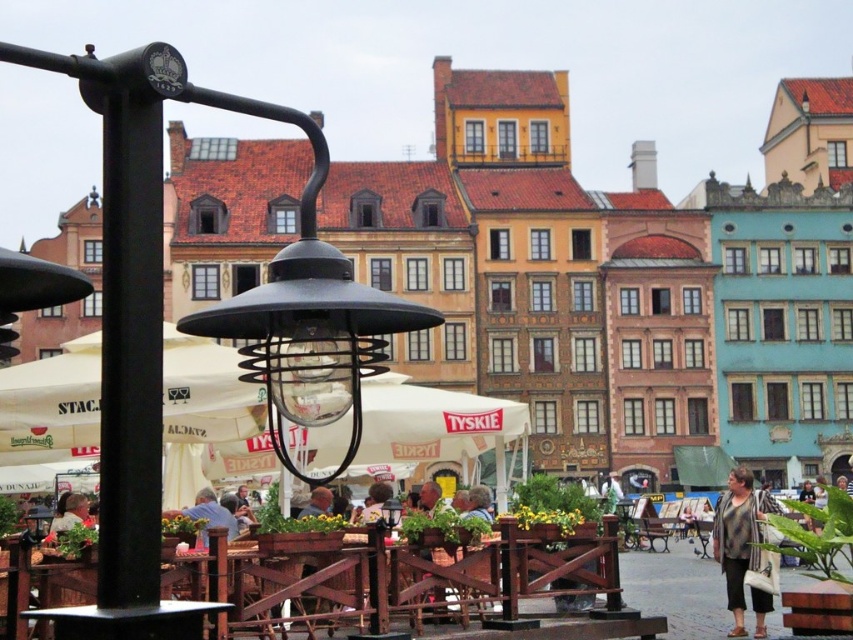
You are setting up a picnic blanket in the town square and need to place it between the wooden table at lower left and the striped fabric shirt at lower right. Which object should you move to make space, and why?

You should move the striped fabric shirt at lower right because the wooden table at lower left is wider and harder to move.

You are a customer looking for a seat in the outdoor dining area. You see a wooden table at lower left and a black matte pole at left. Which object is closer to the entrance of the square?

The wooden table at lower left is closer to the entrance of the square because it is positioned to the right of the black matte pole at left, meaning it is further away from the pole and likely nearer to the entrance.

You are standing in the town square and want to reach the point marked as point (141, 145). Considering the distance between you and that point, can you estimate whether it is within a 100 feet radius from your current position?

The distance between you and point (141, 145) is 121.49 feet, which exceeds the 100 feet radius. Therefore, it is outside the desired range.